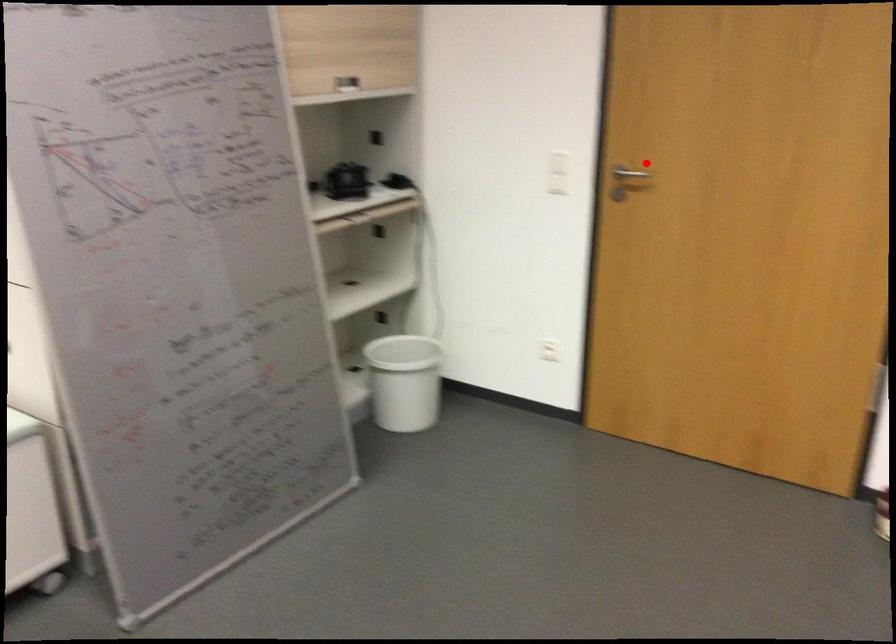
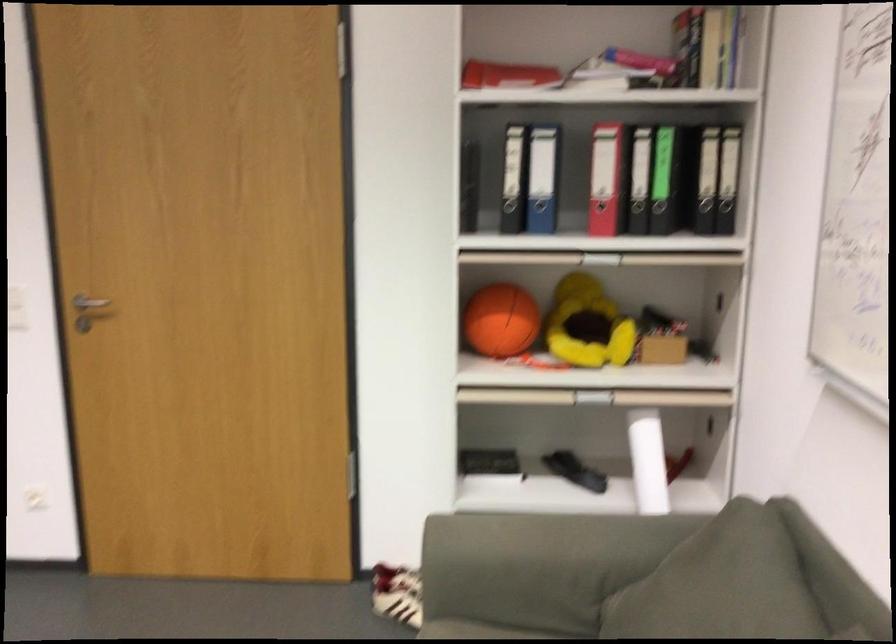
Find the pixel in the second image that matches the highlighted location in the first image.

(88, 305)